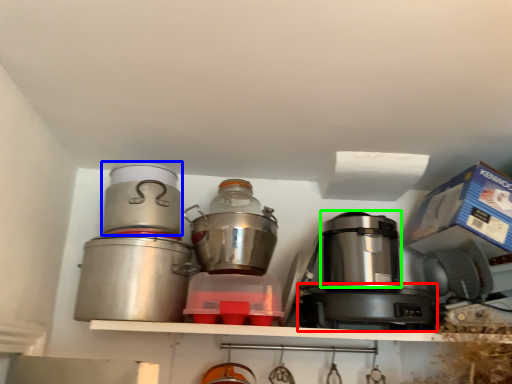
Question: Which object is the closest to the appliance (highlighted by a red box)? Choose among these: kitchen appliance (highlighted by a blue box) or appliance (highlighted by a green box).

Choices:
 (A) kitchen appliance
 (B) appliance

Answer: (B)